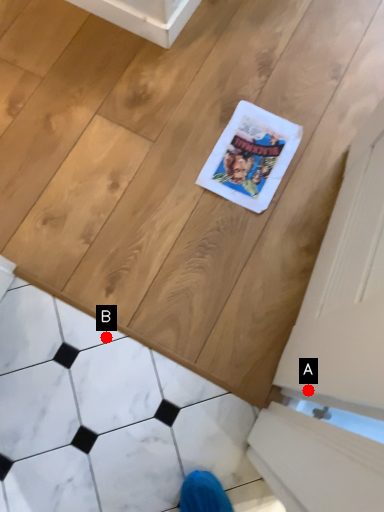
Question: Two points are circled on the image, labeled by A and B beside each circle. Which point is closer to the camera?

Choices:
 (A) A is closer
 (B) B is closer

Answer: (A)